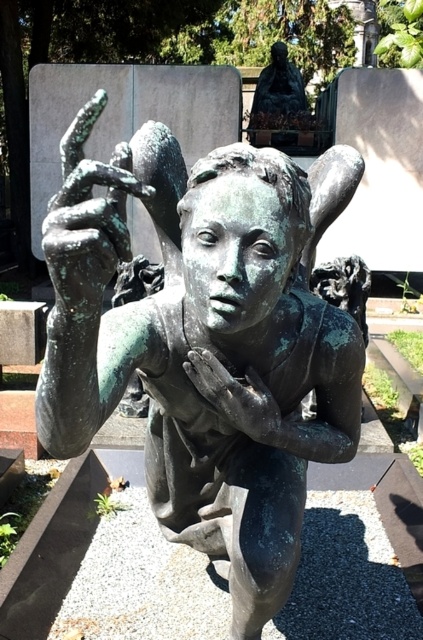
Which is below, green patina bronze statue at center or bronze statue at upper center?

Positioned lower is green patina bronze statue at center.

Between green patina bronze statue at center and bronze statue at upper center, which one appears on the left side from the viewer's perspective?

green patina bronze statue at center

Is point (349, 385) farther from camera compared to point (286, 68)?

That is False.

Find the location of `green patina bronze statue at center`. green patina bronze statue at center is located at coordinates (206, 340).

Does green patina hand at center appear on the left side of bronze statue at upper center?

Indeed, green patina hand at center is positioned on the left side of bronze statue at upper center.

Is green patina hand at center shorter than bronze statue at upper center?

Yes.

Between point (261, 388) and point (299, 104), which one is positioned in front?

Point (261, 388) is in front.

Find the location of a particular element. This screenshot has height=640, width=423. green patina hand at center is located at coordinates (236, 397).

Who is positioned more to the left, green patina bronze statue at center or green patina hand at center?

green patina bronze statue at center

Which is above, green patina bronze statue at center or green patina hand at center?

Positioned higher is green patina bronze statue at center.

Is point (313, 317) in front of point (200, 376)?

No, it is not.

Locate an element on the screen. The image size is (423, 640). green patina bronze statue at center is located at coordinates (206, 340).